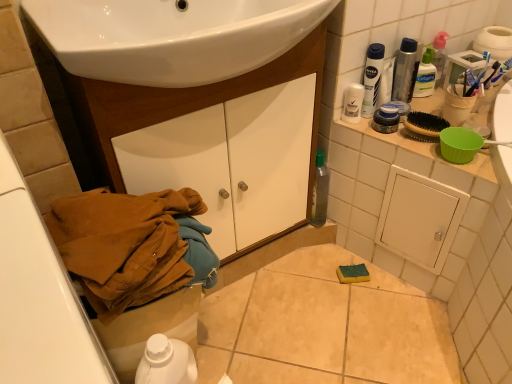
The height and width of the screenshot is (384, 512). I want to click on vacant area that lies in front of translucent plastic pump bottle at upper right, so pyautogui.click(x=455, y=110).